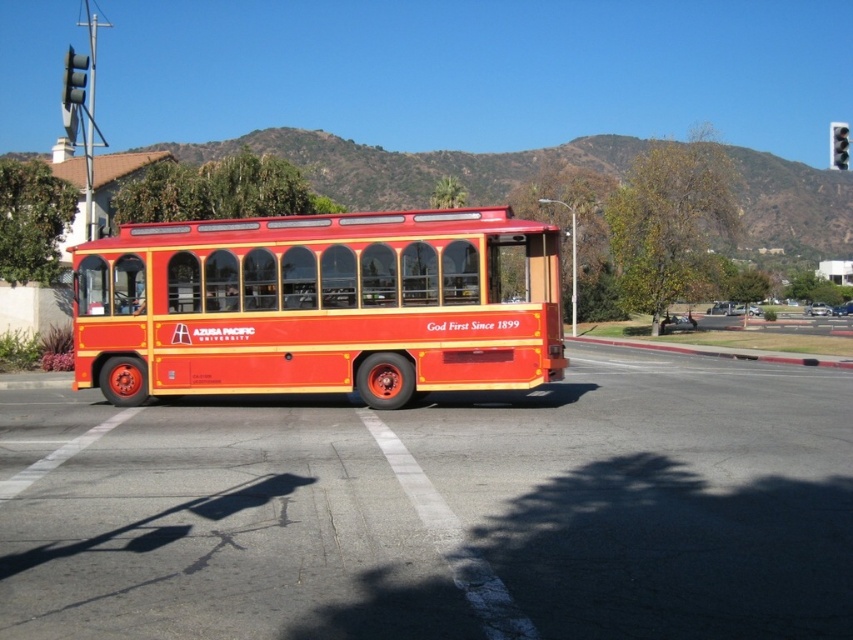
Question: Which of the following is the farthest from the observer?

Choices:
 (A) [486, 340]
 (B) [68, 106]
 (C) [833, 145]

Answer: (B)

Question: Can you confirm if shiny red bus at center is positioned above black plastic traffic light at upper right?

Choices:
 (A) yes
 (B) no

Answer: (B)

Question: Is shiny red bus at center closer to camera compared to black plastic traffic light at upper right?

Choices:
 (A) yes
 (B) no

Answer: (A)

Question: Which of the following is the closest to the observer?

Choices:
 (A) (286, 301)
 (B) (86, 60)
 (C) (842, 134)

Answer: (A)

Question: Is shiny red bus at center above black glass traffic light at upper left?

Choices:
 (A) no
 (B) yes

Answer: (A)

Question: Which object is closer to the camera taking this photo?

Choices:
 (A) black glass traffic light at upper left
 (B) black plastic traffic light at upper right

Answer: (B)